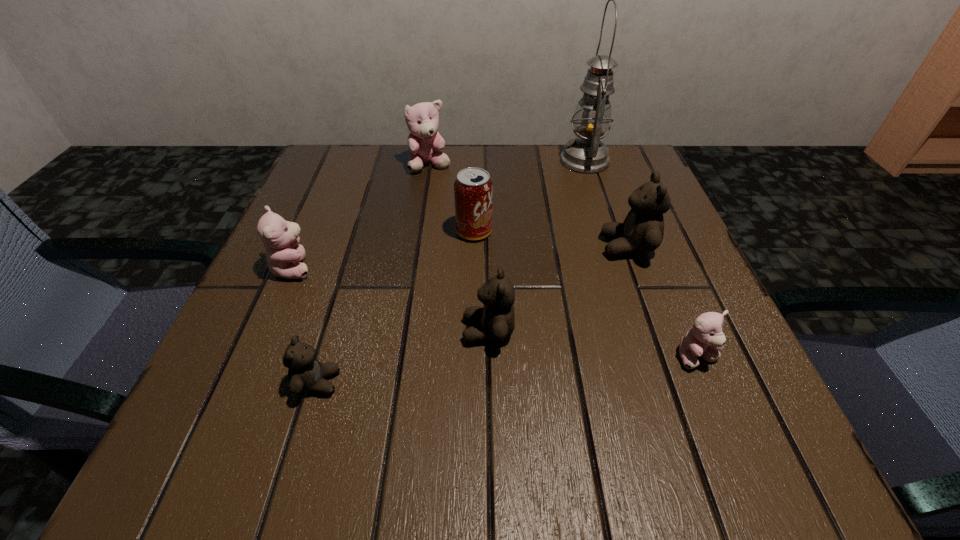
You are a GUI agent. You are given a task and a screenshot of the screen. Output one action in this format:
    pyautogui.click(x=<x>, y=<y>)
    Task: Click on the teddy bear that stands as the third closest to the rightmost pink teddy bear
    The height and width of the screenshot is (540, 960).
    Given the screenshot: What is the action you would take?
    pyautogui.click(x=305, y=373)

What are the coordinates of `the second closest pink teddy bear to the leftmost brown teddy bear` in the screenshot? It's located at (705, 340).

Point out which pink teddy bear is positioned as the second nearest to the leftmost teddy bear. Please provide its 2D coordinates. Your answer should be formatted as a tuple, i.e. [(x, y)], where the tuple contains the x and y coordinates of a point satisfying the conditions above.

[(705, 340)]

This screenshot has height=540, width=960. I want to click on brown teddy bear that is the second closest to the second farthest brown teddy bear, so click(x=642, y=231).

Identify which brown teddy bear is the nearest to the rightmost brown teddy bear. Please provide its 2D coordinates. Your answer should be formatted as a tuple, i.e. [(x, y)], where the tuple contains the x and y coordinates of a point satisfying the conditions above.

[(495, 321)]

Find the location of `free spot that satisfies the following two spatial constraints: 1. at the face of the rightmost pink teddy bear; 2. on the face of the seventh object from right to left`. free spot that satisfies the following two spatial constraints: 1. at the face of the rightmost pink teddy bear; 2. on the face of the seventh object from right to left is located at coordinates (708, 382).

Where is `free spot that satisfies the following two spatial constraints: 1. at the face of the nearest pink teddy bear; 2. on the face of the second teddy bear from left to right`? free spot that satisfies the following two spatial constraints: 1. at the face of the nearest pink teddy bear; 2. on the face of the second teddy bear from left to right is located at coordinates (708, 382).